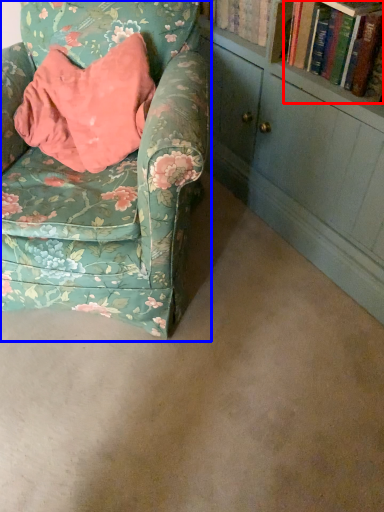
Question: Which object is closer to the camera taking this photo, book (highlighted by a red box) or chair (highlighted by a blue box)?

Choices:
 (A) book
 (B) chair

Answer: (B)